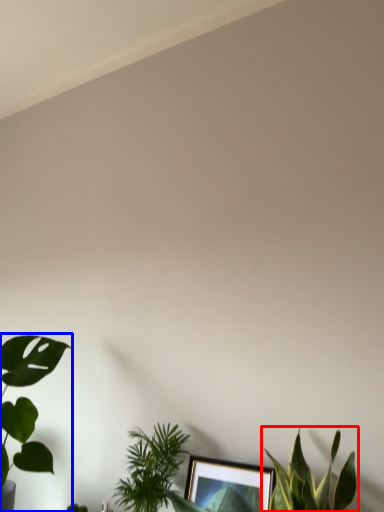
Question: Which object is closer to the camera taking this photo, houseplant (highlighted by a red box) or houseplant (highlighted by a blue box)?

Choices:
 (A) houseplant
 (B) houseplant

Answer: (A)